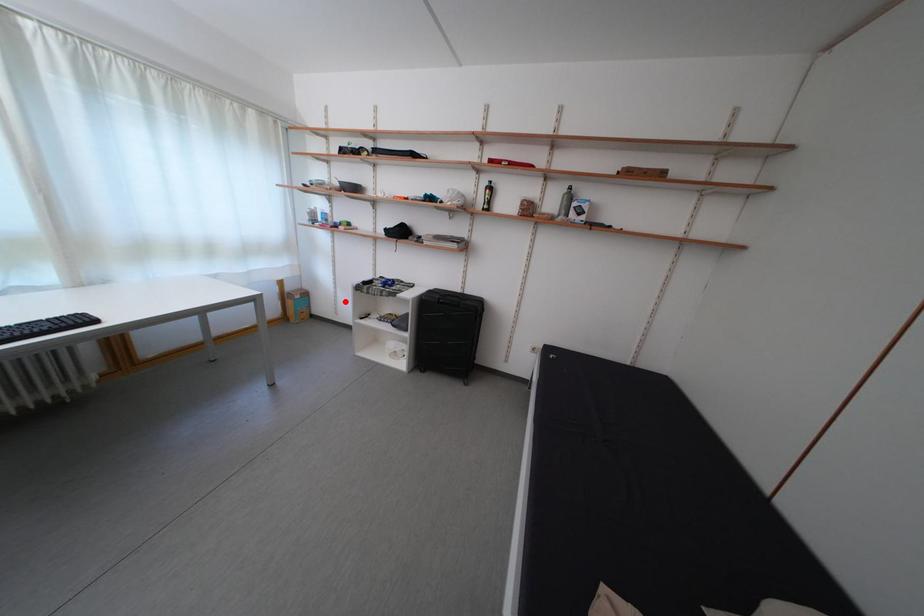
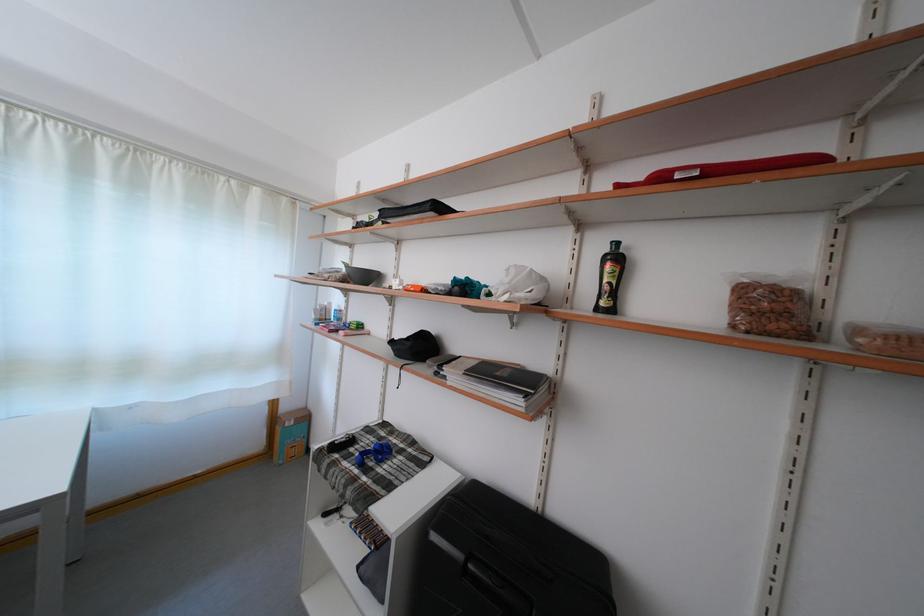
In the second image, find the point that corresponds to the highlighted location in the first image.

(344, 436)